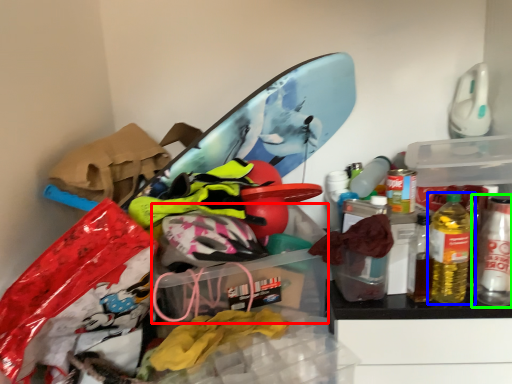
Question: Which is nearer to the storage box (highlighted by a red box)? bottle (highlighted by a blue box) or bottle (highlighted by a green box).

Choices:
 (A) bottle
 (B) bottle

Answer: (A)